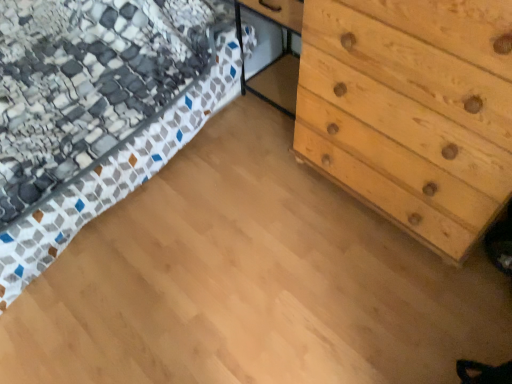
Question: Considering their positions, is patterned fabric bed at upper left located in front of or behind natural wood chest of drawers at right?

Choices:
 (A) behind
 (B) front

Answer: (A)

Question: Would you say patterned fabric bed at upper left is to the left or to the right of natural wood chest of drawers at right in the picture?

Choices:
 (A) left
 (B) right

Answer: (A)

Question: Choose the correct answer: Is patterned fabric bed at upper left inside natural wood chest of drawers at right or outside it?

Choices:
 (A) outside
 (B) inside

Answer: (A)

Question: In terms of width, does natural wood chest of drawers at right look wider or thinner when compared to patterned fabric bed at upper left?

Choices:
 (A) thin
 (B) wide

Answer: (A)

Question: In the image, is natural wood chest of drawers at right on the left side or the right side of patterned fabric bed at upper left?

Choices:
 (A) right
 (B) left

Answer: (A)

Question: Which is correct: natural wood chest of drawers at right is inside patterned fabric bed at upper left, or outside of it?

Choices:
 (A) inside
 (B) outside

Answer: (B)

Question: Considering the positions of natural wood chest of drawers at right and patterned fabric bed at upper left in the image, is natural wood chest of drawers at right taller or shorter than patterned fabric bed at upper left?

Choices:
 (A) short
 (B) tall

Answer: (B)